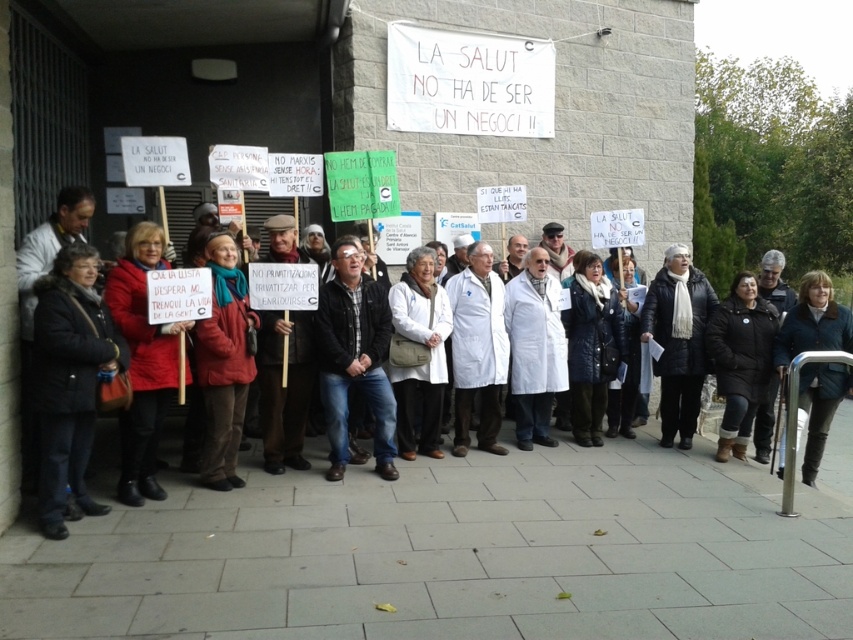
Describe the element at coordinates (460, 486) in the screenshot. I see `white lab coat at center` at that location.

The height and width of the screenshot is (640, 853). What do you see at coordinates (460, 486) in the screenshot?
I see `white lab coat at center` at bounding box center [460, 486].

Locate an element on the screen. The width and height of the screenshot is (853, 640). white lab coat at center is located at coordinates (460, 486).

Is black leather jacket at lower right thinner than blue woolen jacket at center?

No, black leather jacket at lower right is not thinner than blue woolen jacket at center.

Is black leather jacket at lower right wider than blue woolen jacket at center?

Indeed, black leather jacket at lower right has a greater width compared to blue woolen jacket at center.

Who is more forward, (730, 324) or (801, 300)?

Positioned in front is point (801, 300).

Identify the location of black leather jacket at lower right. (740, 360).

Find the location of a particular element. red wool coat at center is located at coordinates click(x=142, y=362).

Is point (148, 252) closer to viewer compared to point (738, 449)?

Yes.

Identify the location of red wool coat at center. The width and height of the screenshot is (853, 640). (142, 362).